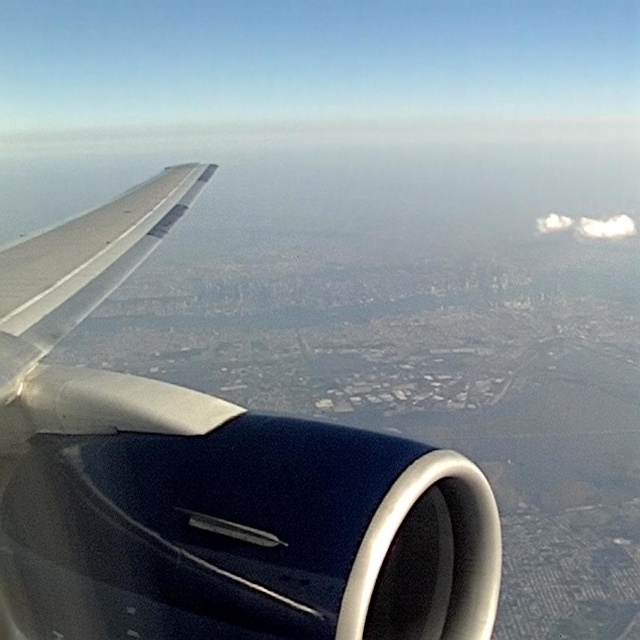
In the scene shown: You are inside an airplane and looking out the window. You see two points marked on the wing and engine. The first point is at coordinates point (241, 417) and the second point is at point (548, 218). Which point is closer to your eyes?

Point (241, 417) is closer to the camera than point (548, 218).

You are a pilot checking the engine position relative to the wing. According to the image, where is the metallic blue engine at center located in relation to the wing?

Result: The metallic blue engine at center is positioned below the wing, as its coordinates at point (208, 483) place it lower in the frame compared to the wing extending diagonally across the left side.

You are a flight attendant standing in the aisle of the airplane. You want to hand a drink to a passenger seated directly in front of the metallic blue engine at center. The tray table in front of the passenger is 1.2 meters away from you. Can you reach the tray table without moving closer?

The metallic blue engine at center is 1.18 meters away from you. Since the tray table is 1.2 meters away, which is slightly farther than the engine, you can just barely reach it if you stretch out your arm fully.